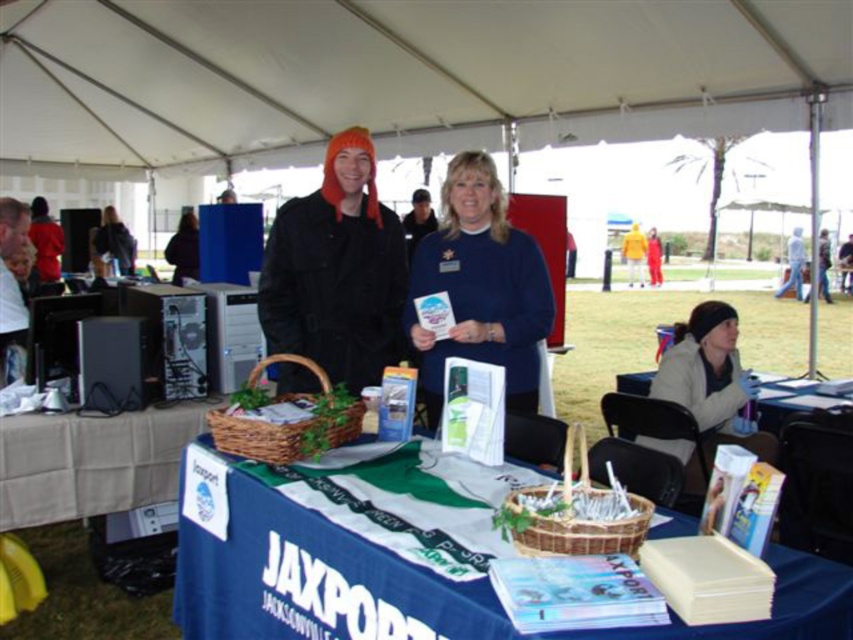
Find the location of `blue fabric table at center`. blue fabric table at center is located at coordinates (398, 579).

Can you confirm if blue fabric table at center is shorter than white cardboard box at center?

Incorrect, blue fabric table at center's height does not fall short of white cardboard box at center's.

Find the location of a particular element. The height and width of the screenshot is (640, 853). blue fabric table at center is located at coordinates (398, 579).

Does point (142, 467) come farther from viewer compared to point (717, 349)?

No, it is in front of (717, 349).

Who is more distant from viewer, (166,464) or (701,339)?

The point (701,339) is behind.

At what (x,y) coordinates should I click in order to perform the action: click on white cardboard box at center. Please return your answer as a coordinate pair (x, y). The height and width of the screenshot is (640, 853). Looking at the image, I should click on (91, 461).

Who is taller, blue fabric table at center or blue fleece sweater at center?

blue fleece sweater at center

Does blue fabric table at center have a smaller size compared to blue fleece sweater at center?

Incorrect, blue fabric table at center is not smaller in size than blue fleece sweater at center.

Identify the location of blue fabric table at center. (398, 579).